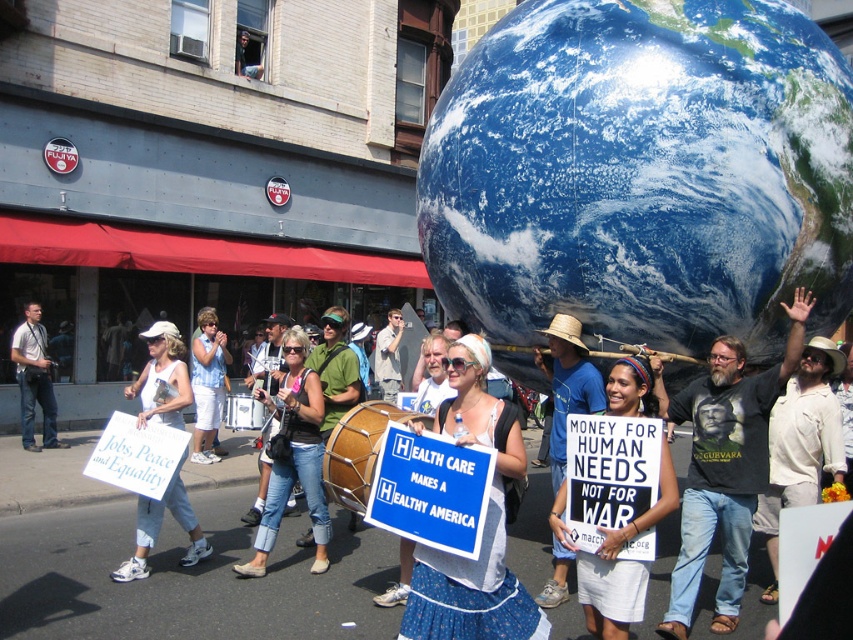
Question: Which point appears closest to the camera in this image?

Choices:
 (A) (32, 368)
 (B) (212, 356)

Answer: (B)

Question: Is blue glossy earth at upper center positioned before white fabric dress at center?

Choices:
 (A) no
 (B) yes

Answer: (A)

Question: Is beige cotton shirt at center closer to the viewer compared to white fabric dress at center?

Choices:
 (A) no
 (B) yes

Answer: (A)

Question: Where is beige cotton shirt at center located in relation to white fabric sign at lower left in the image?

Choices:
 (A) right
 (B) left

Answer: (A)

Question: Among these points, which one is farthest from the camera?

Choices:
 (A) (263, 516)
 (B) (786, 378)

Answer: (A)

Question: Which object is closer to the camera taking this photo?

Choices:
 (A) blue glossy earth at upper center
 (B) white cotton shorts at lower center
 (C) blue denim shorts at center

Answer: (B)